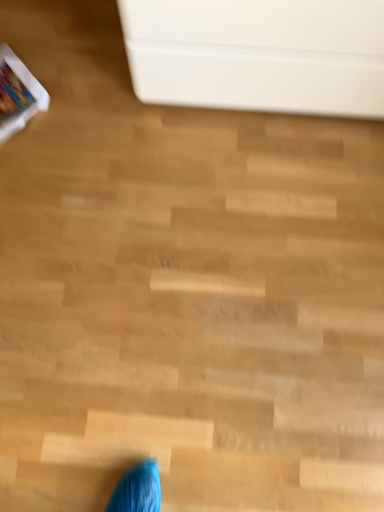
Find the location of a particular element. This screenshot has height=512, width=384. free space in front of white glossy dishwasher at upper center is located at coordinates (240, 218).